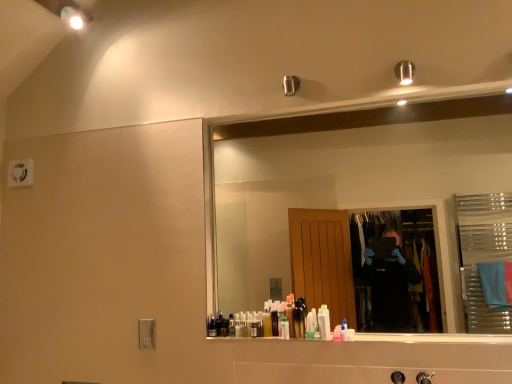
You are a GUI agent. You are given a task and a screenshot of the screen. Output one action in this format:
    pyautogui.click(x=<x>, y=<y>)
    Task: Click on the free space to the left of translucent plastic tube at center, the second toiletry viewed from the left
    The width and height of the screenshot is (512, 384).
    Given the screenshot: What is the action you would take?
    tap(256, 342)